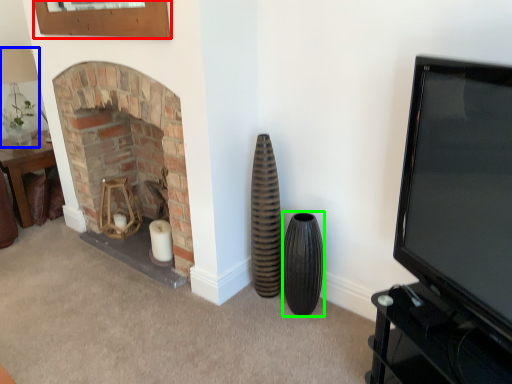
Question: Based on their relative distances, which object is farther from picture frame (highlighted by a red box)? Choose from lamp (highlighted by a blue box) and vase (highlighted by a green box).

Choices:
 (A) lamp
 (B) vase

Answer: (B)